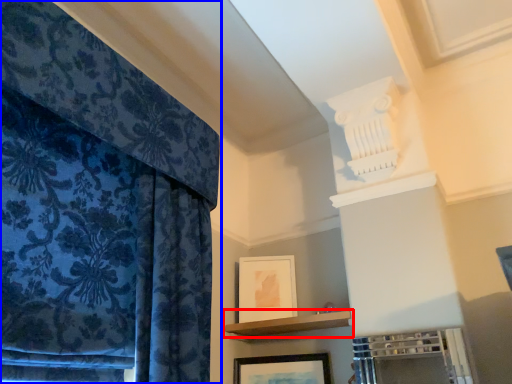
Question: Which point is further to the camera, shelf (highlighted by a red box) or curtain (highlighted by a blue box)?

Choices:
 (A) shelf
 (B) curtain

Answer: (A)